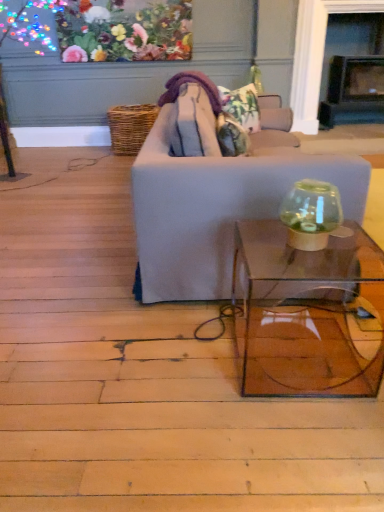
Where is `transparent glass fishbowl at right`? This screenshot has width=384, height=512. transparent glass fishbowl at right is located at coordinates (311, 214).

Where is `transparent glass table at center`? The width and height of the screenshot is (384, 512). transparent glass table at center is located at coordinates (308, 313).

This screenshot has width=384, height=512. In order to click on floral fabric pillow at center in this screenshot , I will do `click(242, 106)`.

Consider the image. Is transparent glass fishbowl at right smaller than light gray fabric couch at center?

Yes, transparent glass fishbowl at right is smaller than light gray fabric couch at center.

Is point (309, 211) closer or farther from the camera than point (361, 170)?

Point (309, 211) is closer to the camera than point (361, 170).

Is the position of transparent glass fishbowl at right more distant than that of light gray fabric couch at center?

No, transparent glass fishbowl at right is closer to the camera.

Is transparent glass fishbowl at right turned away from light gray fabric couch at center?

That's not correct — transparent glass fishbowl at right is not looking away from light gray fabric couch at center.

This screenshot has height=512, width=384. In order to click on floral arrangement on the left of light gray fabric couch at center in this screenshot , I will do `click(125, 31)`.

Based on the photo, can you confirm if floral print fabric at upper center is shorter than light gray fabric couch at center?

Yes, floral print fabric at upper center is shorter than light gray fabric couch at center.

Considering the points (131, 20) and (159, 142), which point is in front, point (131, 20) or point (159, 142)?

Point (159, 142)

Considering the positions of objects floral print fabric at upper center and light gray fabric couch at center in the image provided, who is more to the left, floral print fabric at upper center or light gray fabric couch at center?

Positioned to the left is floral print fabric at upper center.

From the image's perspective, does floral print fabric at upper center appear lower than transparent glass table at center?

Incorrect, from the image's perspective, floral print fabric at upper center is higher than transparent glass table at center.

Which of these two, floral print fabric at upper center or transparent glass table at center, is bigger?

transparent glass table at center is bigger.

Considering the positions of objects floral print fabric at upper center and transparent glass table at center in the image provided, who is more to the left, floral print fabric at upper center or transparent glass table at center?

floral print fabric at upper center is more to the left.

Which is in front, floral print fabric at upper center or transparent glass table at center?

transparent glass table at center is closer to the camera.

Which object is thinner, floral print fabric at upper center or floral fabric pillow at center?

Thinner between the two is floral print fabric at upper center.

How many degrees apart are the facing directions of floral print fabric at upper center and floral fabric pillow at center?

42.8 degrees.

Is floral print fabric at upper center oriented away from floral fabric pillow at center?

No, floral print fabric at upper center's orientation is not away from floral fabric pillow at center.

From the image's perspective, relative to floral fabric pillow at center, is floral print fabric at upper center above or below?

Based on their image positions, floral print fabric at upper center is located above floral fabric pillow at center.

Does point (245, 97) appear closer or farther from the camera than point (291, 162)?

Point (245, 97) is farther from the camera than point (291, 162).

Which object is positioned more to the left, floral fabric pillow at center or light gray fabric couch at center?

light gray fabric couch at center is more to the left.

Is floral fabric pillow at center turned away from light gray fabric couch at center?

That's right, floral fabric pillow at center is facing away from light gray fabric couch at center.

From the image's perspective, is floral fabric pillow at center located above or below light gray fabric couch at center?

floral fabric pillow at center is situated higher than light gray fabric couch at center in the image.

How much distance is there between floral fabric pillow at center and transparent glass fishbowl at right?

floral fabric pillow at center and transparent glass fishbowl at right are 1.63 meters apart.

Considering the points (247, 88) and (304, 200), which point is in front, point (247, 88) or point (304, 200)?

The point (304, 200) is closer.

Is there a large distance between floral fabric pillow at center and transparent glass fishbowl at right?

Yes, floral fabric pillow at center and transparent glass fishbowl at right are located far from each other.

Is floral fabric pillow at center facing away from transparent glass fishbowl at right?

No, floral fabric pillow at center is not facing the opposite direction of transparent glass fishbowl at right.

Can you confirm if transparent glass fishbowl at right is bigger than floral print fabric at upper center?

Incorrect, transparent glass fishbowl at right is not larger than floral print fabric at upper center.

In terms of height, does transparent glass fishbowl at right look taller or shorter compared to floral print fabric at upper center?

Clearly, transparent glass fishbowl at right is shorter compared to floral print fabric at upper center.

How different are the orientations of transparent glass fishbowl at right and floral print fabric at upper center in degrees?

The facing directions of transparent glass fishbowl at right and floral print fabric at upper center are 88.9 degrees apart.

Is transparent glass fishbowl at right to the left or to the right of floral print fabric at upper center in the image?

transparent glass fishbowl at right is positioned on floral print fabric at upper center's right side.

This screenshot has width=384, height=512. What are the coordinates of `glass vase located in front of the light gray fabric couch at center` in the screenshot? It's located at (311, 214).

Locate an element on the screen. The height and width of the screenshot is (512, 384). studio couch on the right of floral print fabric at upper center is located at coordinates (212, 193).

Based on the photo, from the image, which object appears to be nearer to transparent glass table at center, floral print fabric at upper center or transparent glass fishbowl at right?

The object closer to transparent glass table at center is transparent glass fishbowl at right.

Looking at the image, which one is located closer to floral print fabric at upper center, transparent glass fishbowl at right or light gray fabric couch at center?

The object closer to floral print fabric at upper center is light gray fabric couch at center.

Looking at the image, which one is located closer to light gray fabric couch at center, floral print fabric at upper center or transparent glass fishbowl at right?

The object closer to light gray fabric couch at center is transparent glass fishbowl at right.

Which object lies nearer to the anchor point floral fabric pillow at center, floral print fabric at upper center or transparent glass table at center?

transparent glass table at center is closer to floral fabric pillow at center.

Based on their spatial positions, is transparent glass table at center or floral print fabric at upper center closer to light gray fabric couch at center?

transparent glass table at center is closer to light gray fabric couch at center.

Which object lies nearer to the anchor point transparent glass table at center, floral fabric pillow at center or light gray fabric couch at center?

light gray fabric couch at center is closer to transparent glass table at center.

Consider the image. Estimate the real-world distances between objects in this image. Which object is closer to transparent glass fishbowl at right, transparent glass table at center or light gray fabric couch at center?

The object closer to transparent glass fishbowl at right is transparent glass table at center.

Which object lies further to the anchor point light gray fabric couch at center, transparent glass fishbowl at right or floral fabric pillow at center?

Based on the image, floral fabric pillow at center appears to be further to light gray fabric couch at center.

Find the location of a particular element. This screenshot has width=384, height=512. glass vase between transparent glass table at center and floral fabric pillow at center in the front-back direction is located at coordinates (311, 214).

Locate an element on the screen. studio couch between transparent glass table at center and floral fabric pillow at center in the front-back direction is located at coordinates (212, 193).

You are a GUI agent. You are given a task and a screenshot of the screen. Output one action in this format:
    pyautogui.click(x=<x>, y=<y>)
    Task: Click on the studio couch between transparent glass fishbowl at right and floral fabric pillow at center along the z-axis
    
    Given the screenshot: What is the action you would take?
    pyautogui.click(x=212, y=193)

The width and height of the screenshot is (384, 512). In order to click on studio couch located between transparent glass table at center and floral print fabric at upper center in the depth direction in this screenshot , I will do `click(212, 193)`.